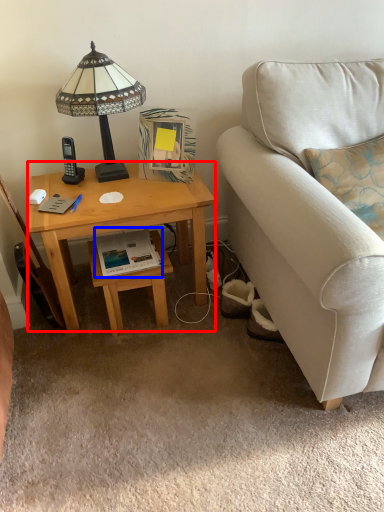
Question: Which of the following is the farthest to the observer, desk (highlighted by a red box) or book (highlighted by a blue box)?

Choices:
 (A) desk
 (B) book

Answer: (B)